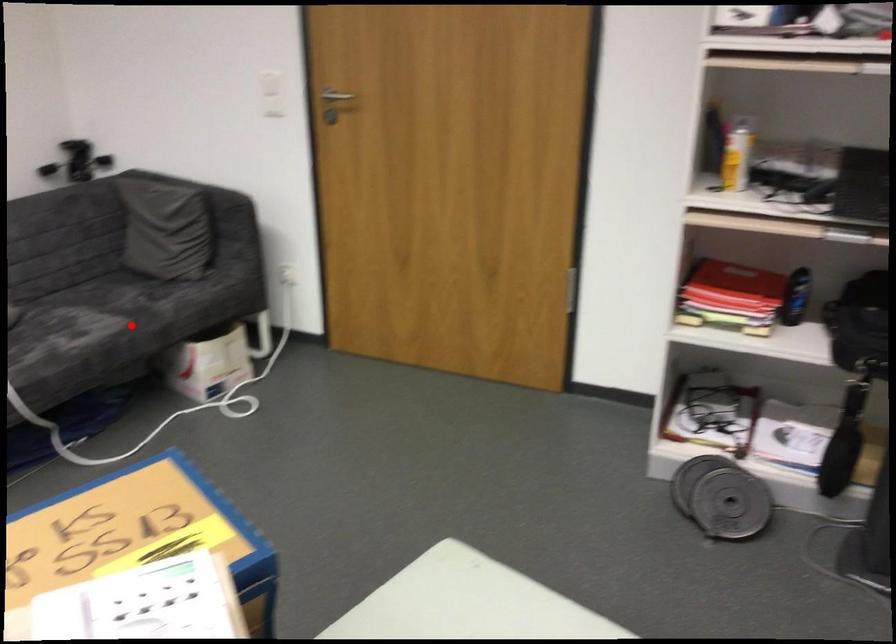
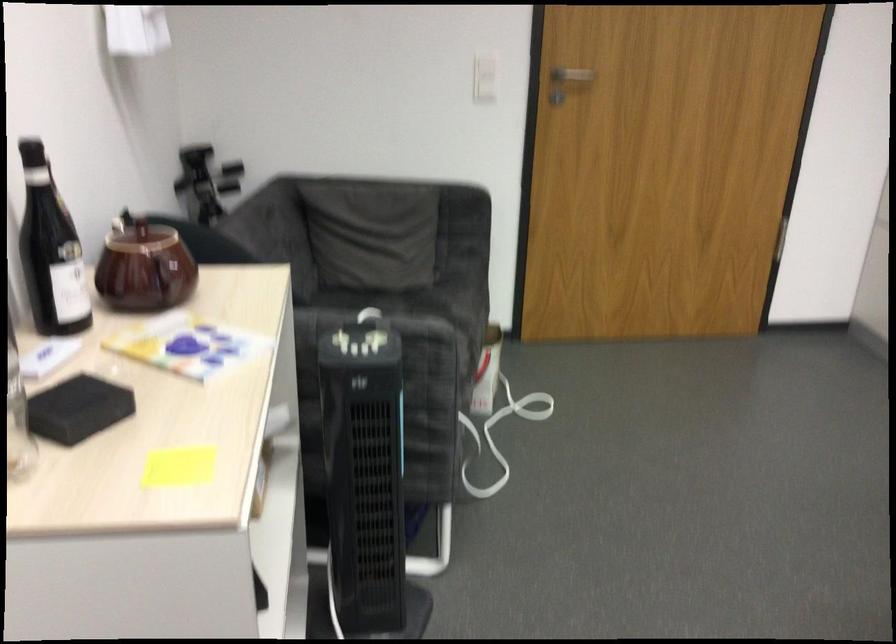
Question: I am providing you with two images of the same scene from different viewpoints. A red point is shown in image1. For the corresponding object point in image2, is it positioned nearer or farther from the camera?

Choices:
 (A) Nearer
 (B) Farther

Answer: (A)